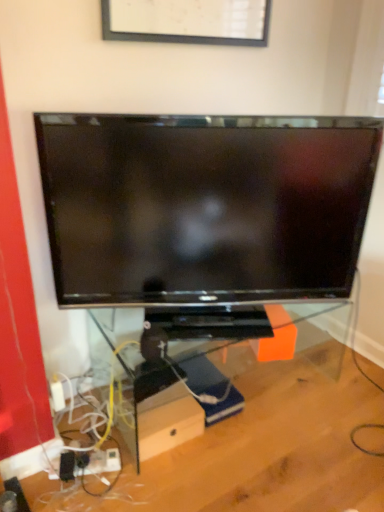
You are a GUI agent. You are given a task and a screenshot of the screen. Output one action in this format:
    pyautogui.click(x=<x>, y=<y>)
    Task: Click on the transparent glass tv stand at center
    
    Given the screenshot: What is the action you would take?
    pyautogui.click(x=208, y=370)

What do you see at coordinates (208, 370) in the screenshot? I see `transparent glass tv stand at center` at bounding box center [208, 370].

Locate an element on the screen. The image size is (384, 512). transparent glass tv stand at center is located at coordinates (208, 370).